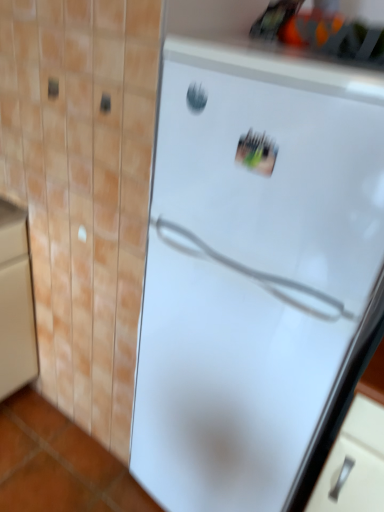
What do you see at coordinates (256, 274) in the screenshot?
I see `white glossy refrigerator at center` at bounding box center [256, 274].

Where is `white glossy refrigerator at center`? The height and width of the screenshot is (512, 384). white glossy refrigerator at center is located at coordinates pos(256,274).

This screenshot has height=512, width=384. Find the location of `white glossy refrigerator at center`. white glossy refrigerator at center is located at coordinates (256, 274).